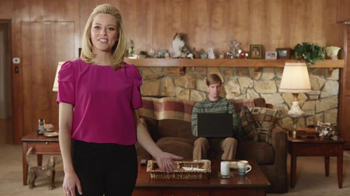
At what (x,y) coordinates should I click in order to perform the action: click on wooden mantel. Please return your answer as a coordinate pair (x, y). This screenshot has height=196, width=350. Looking at the image, I should click on (237, 61).